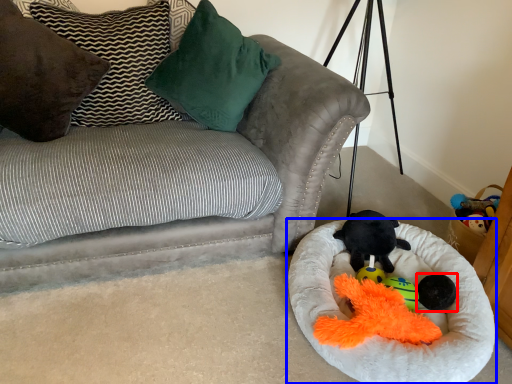
Question: Which object appears closest to the camera in this image, toy (highlighted by a red box) or dog bed (highlighted by a blue box)?

Choices:
 (A) toy
 (B) dog bed

Answer: (B)